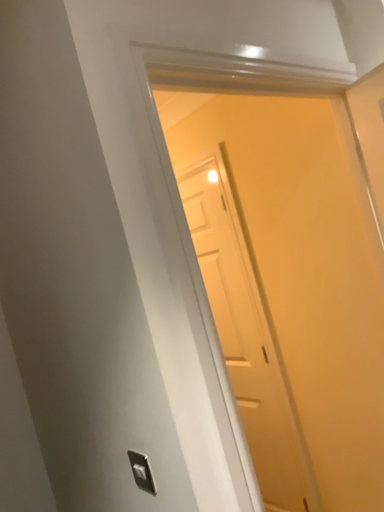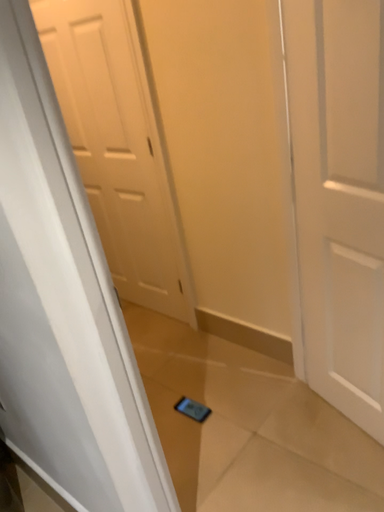
Question: Which way did the camera rotate in the video?

Choices:
 (A) rotated left
 (B) rotated right

Answer: (B)